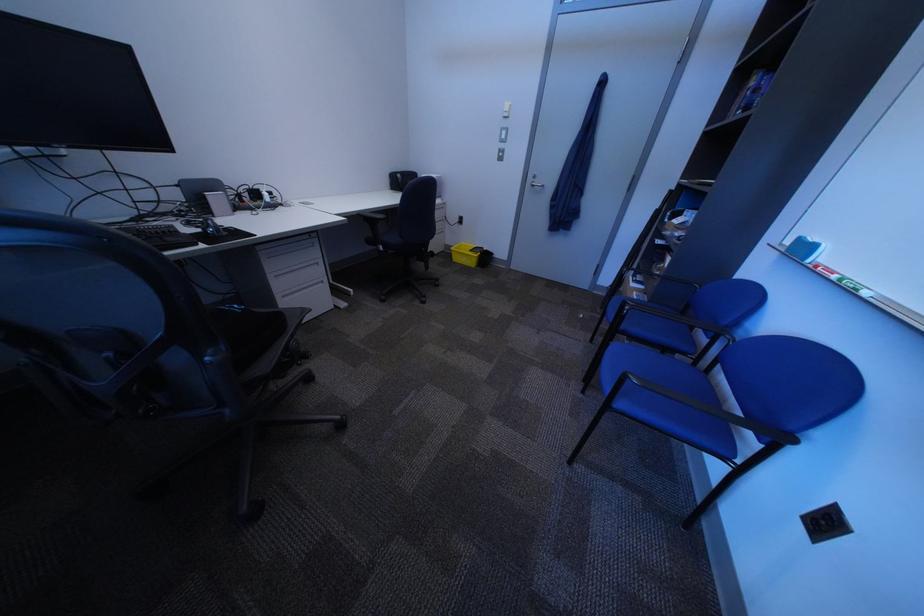
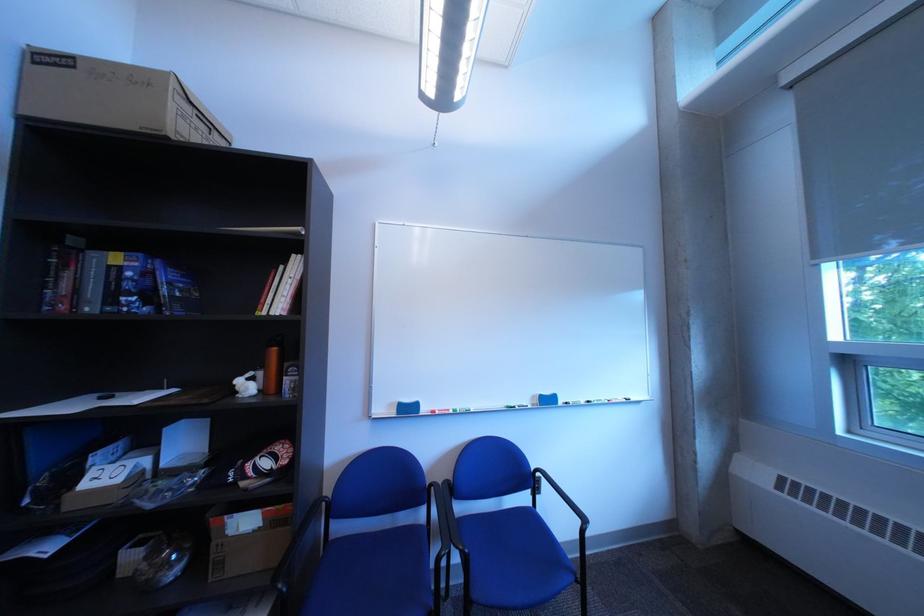
Locate, in the second image, the point that corresponds to (755,113) in the first image.

(150, 300)